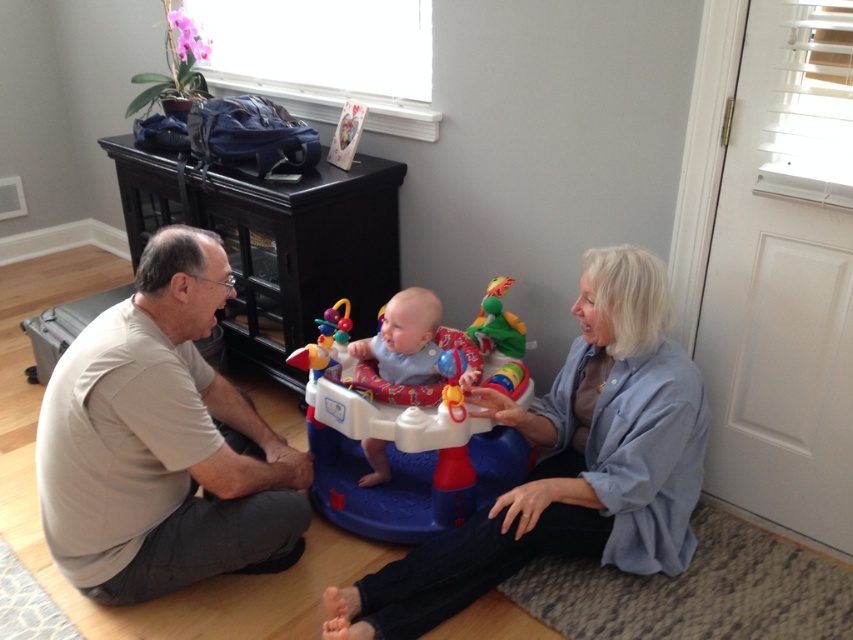
Between blue plastic baby walker at center and blue fabric baby at center, which one has more height?

Standing taller between the two is blue plastic baby walker at center.

Can you confirm if blue plastic baby walker at center is positioned above blue fabric baby at center?

Incorrect, blue plastic baby walker at center is not positioned above blue fabric baby at center.

Which is in front, point (345, 394) or point (479, 372)?

Positioned in front is point (345, 394).

Find the location of a particular element. The image size is (853, 640). blue plastic baby walker at center is located at coordinates (408, 419).

Who is positioned more to the right, light beige t-shirt at left or blue plastic baby walker at center?

From the viewer's perspective, blue plastic baby walker at center appears more on the right side.

Does point (200, 509) lie behind point (329, 445)?

No.

The image size is (853, 640). I want to click on light beige t-shirt at left, so (161, 444).

This screenshot has width=853, height=640. Describe the element at coordinates (161, 444) in the screenshot. I see `light beige t-shirt at left` at that location.

Looking at this image, between light beige t-shirt at left and blue cotton shirt at center, which one is positioned higher?

Positioned higher is light beige t-shirt at left.

Does point (190, 547) come in front of point (326, 636)?

No, it is not.

Image resolution: width=853 pixels, height=640 pixels. Find the location of `light beige t-shirt at left`. light beige t-shirt at left is located at coordinates (161, 444).